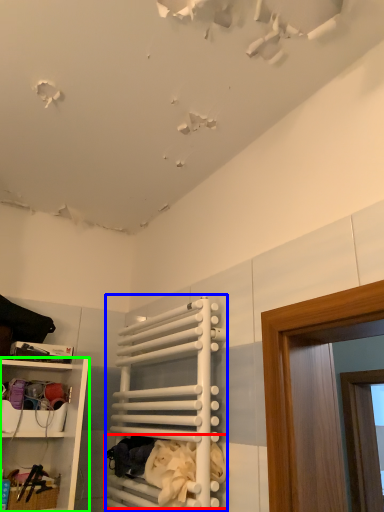
Question: Which object is the farthest from laundry (highlighted by a red box)? Choose among these: cabinet (highlighted by a blue box) or shelf (highlighted by a green box).

Choices:
 (A) cabinet
 (B) shelf

Answer: (B)